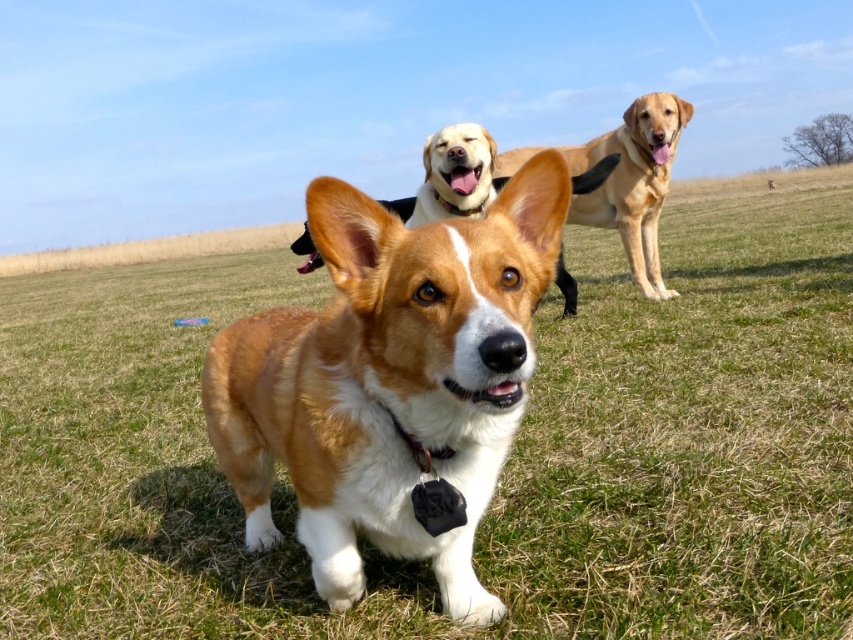
Question: Based on their relative distances, which object is nearer to the golden fur dog at upper center?

Choices:
 (A) smooth golden retriever at upper center
 (B) brown and white fur at center
 (C) golden fur dog at center

Answer: (A)

Question: Which point appears closest to the camera in this image?

Choices:
 (A) (810, 285)
 (B) (386, 205)
 (C) (415, 196)

Answer: (C)

Question: Which of the following is the farthest from the observer?

Choices:
 (A) brown and white fur at center
 (B) golden fur dog at center
 (C) smooth golden retriever at upper center

Answer: (B)

Question: Is green grass at center positioned in front of golden fur dog at center?

Choices:
 (A) yes
 (B) no

Answer: (A)

Question: Observing the image, what is the correct spatial positioning of green grass at center in reference to smooth golden retriever at upper center?

Choices:
 (A) below
 (B) above

Answer: (B)

Question: From the image, what is the correct spatial relationship of brown and white fur at center in relation to golden fur dog at upper center?

Choices:
 (A) left
 (B) right

Answer: (A)